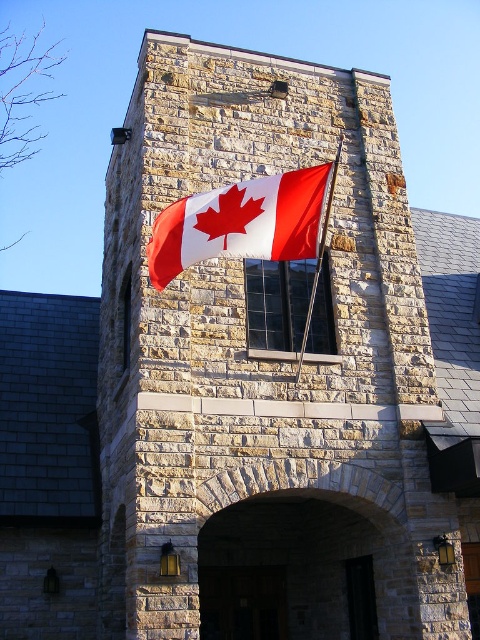
Question: Can you confirm if red and white fabric flag at center is wider than metallic flag pole at center?

Choices:
 (A) yes
 (B) no

Answer: (B)

Question: Is red and white fabric flag at center below metallic flag pole at center?

Choices:
 (A) yes
 (B) no

Answer: (B)

Question: Among these points, which one is nearest to the camera?

Choices:
 (A) (325, 205)
 (B) (273, 211)

Answer: (B)

Question: Can you confirm if red and white fabric flag at center is positioned to the left of metallic flag pole at center?

Choices:
 (A) no
 (B) yes

Answer: (B)